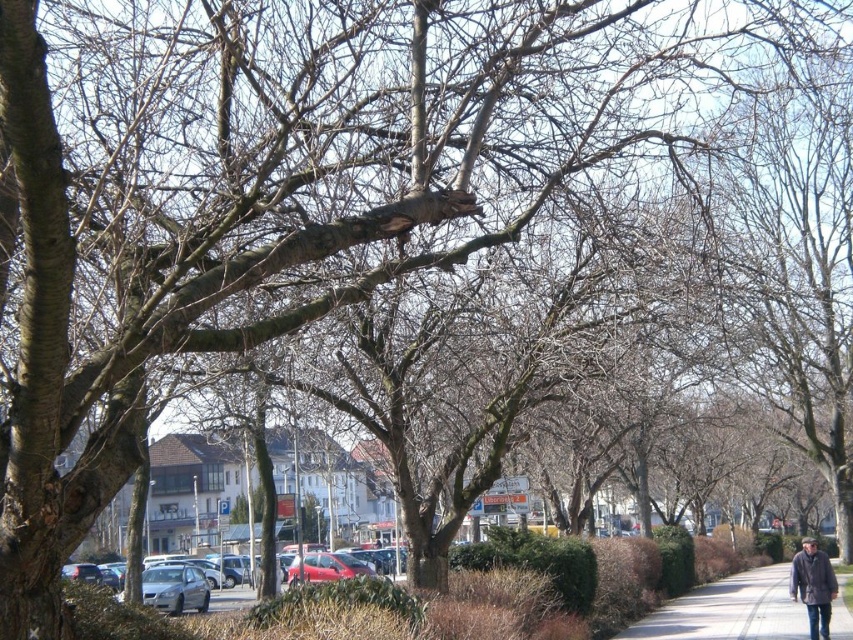
You are standing at the edge of the sidewalk and see the gray asphalt pavement at lower right and the dark gray wool coat at right. Which object is positioned to the right of the other?

The gray asphalt pavement at lower right is to the right of the dark gray wool coat at right according to the description.

You are standing at the point labeled as point (728, 611) in the image. What surface are you currently standing on?

The point (728, 611) is on gray asphalt pavement at lower right, so you are standing on gray asphalt pavement.